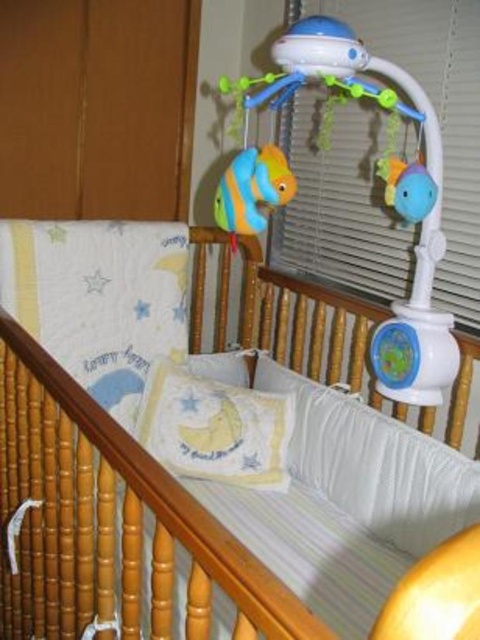
Does blue plastic mobile at upper center appear over white plush pillow at center?

Indeed, blue plastic mobile at upper center is positioned over white plush pillow at center.

Is the position of blue plastic mobile at upper center less distant than that of white plush pillow at center?

Yes, it is in front of white plush pillow at center.

Where is `blue plastic mobile at upper center`? Image resolution: width=480 pixels, height=640 pixels. blue plastic mobile at upper center is located at coordinates (344, 200).

In the scene shown: Can you confirm if multicolored plush fish at upper center is positioned above blue rubber duck at upper right?

Actually, multicolored plush fish at upper center is below blue rubber duck at upper right.

Can you confirm if multicolored plush fish at upper center is positioned below blue rubber duck at upper right?

Yes.

At what (x,y) coordinates should I click in order to perform the action: click on multicolored plush fish at upper center. Please return your answer as a coordinate pair (x, y). The height and width of the screenshot is (640, 480). Looking at the image, I should click on 252,189.

Is white striped mattress at center to the right of multicolored plush fish at upper center from the viewer's perspective?

Incorrect, white striped mattress at center is not on the right side of multicolored plush fish at upper center.

This screenshot has width=480, height=640. In order to click on white striped mattress at center in this screenshot , I will do `click(190, 480)`.

This screenshot has height=640, width=480. What are the coordinates of `white striped mattress at center` in the screenshot? It's located at (190, 480).